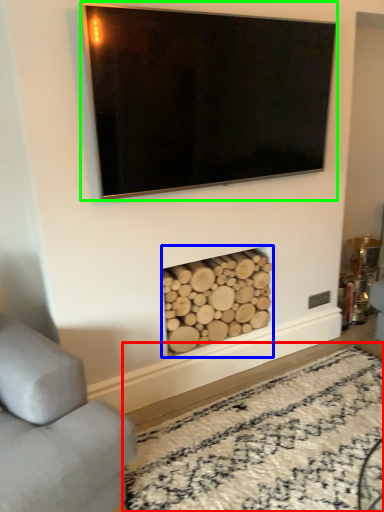
Question: Which is nearer to the plain (highlighted by a red box)? fireplace (highlighted by a blue box) or television (highlighted by a green box).

Choices:
 (A) fireplace
 (B) television

Answer: (A)